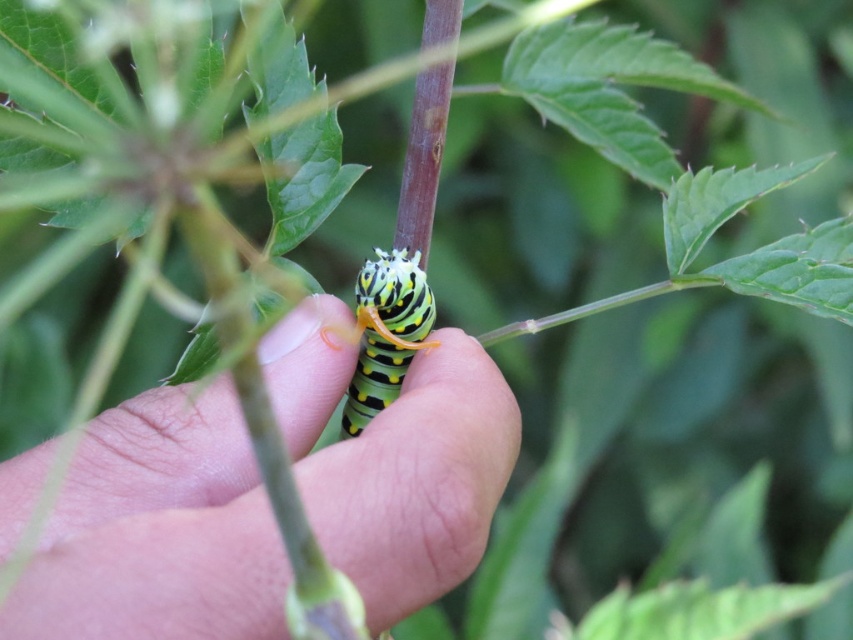
Can you confirm if green matte caterpillar at center is shorter than yellow-green striped caterpillar at center?

In fact, green matte caterpillar at center may be taller than yellow-green striped caterpillar at center.

Between green matte caterpillar at center and yellow-green striped caterpillar at center, which one has less height?

With less height is yellow-green striped caterpillar at center.

Where is `green matte caterpillar at center`? Image resolution: width=853 pixels, height=640 pixels. green matte caterpillar at center is located at coordinates (157, 531).

The height and width of the screenshot is (640, 853). I want to click on green matte caterpillar at center, so click(x=157, y=531).